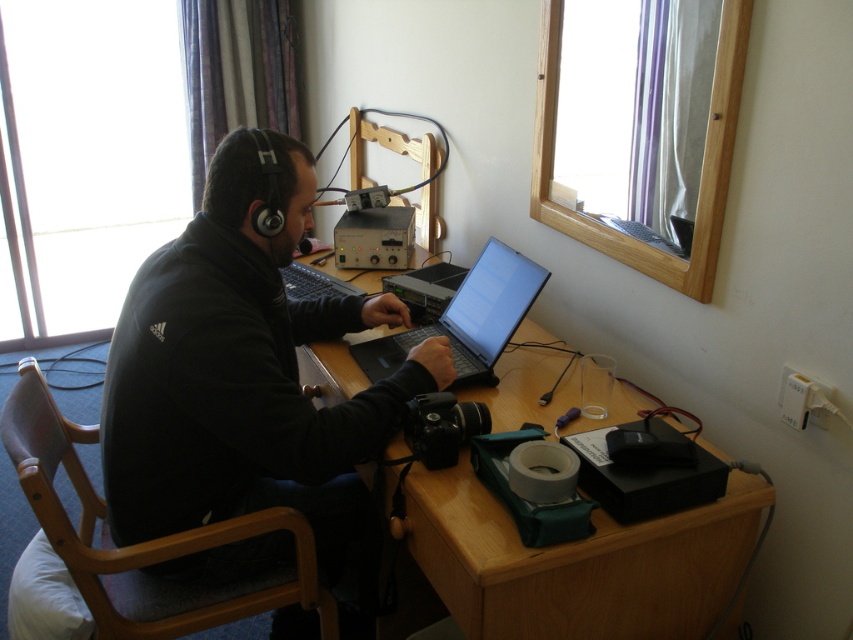
At what (x,y) coordinates should I click in order to perform the action: click on black matte jacket at center. Please return your answer as a coordinate pair (x, y). This screenshot has width=853, height=640. Looking at the image, I should click on (242, 369).

Which of these two, black matte jacket at center or black fabric chair at left, stands taller?

black matte jacket at center

In the scene shown: Who is more forward, [161,513] or [123,618]?

Point [123,618] is more forward.

Where is `black matte jacket at center`? The height and width of the screenshot is (640, 853). black matte jacket at center is located at coordinates (242, 369).

In the scene shown: Is wooden at center positioned before black plastic laptop at center?

Yes, wooden at center is closer to the viewer.

Is wooden at center bigger than black plastic laptop at center?

Correct, wooden at center is larger in size than black plastic laptop at center.

Between point (466, 396) and point (490, 348), which one is positioned in front?

Positioned in front is point (466, 396).

The height and width of the screenshot is (640, 853). In order to click on wooden at center in this screenshot , I will do `click(579, 564)`.

Which of these two, black fabric chair at left or black plastic laptop at center, stands taller?

With more height is black fabric chair at left.

Does black fabric chair at left have a smaller size compared to black plastic laptop at center?

No, black fabric chair at left is not smaller than black plastic laptop at center.

Does point (154, 632) come behind point (489, 272)?

No, (154, 632) is in front of (489, 272).

You are a GUI agent. You are given a task and a screenshot of the screen. Output one action in this format:
    pyautogui.click(x=<x>, y=<y>)
    Task: Click on the black fabric chair at left
    
    Given the screenshot: What is the action you would take?
    pyautogui.click(x=125, y=548)